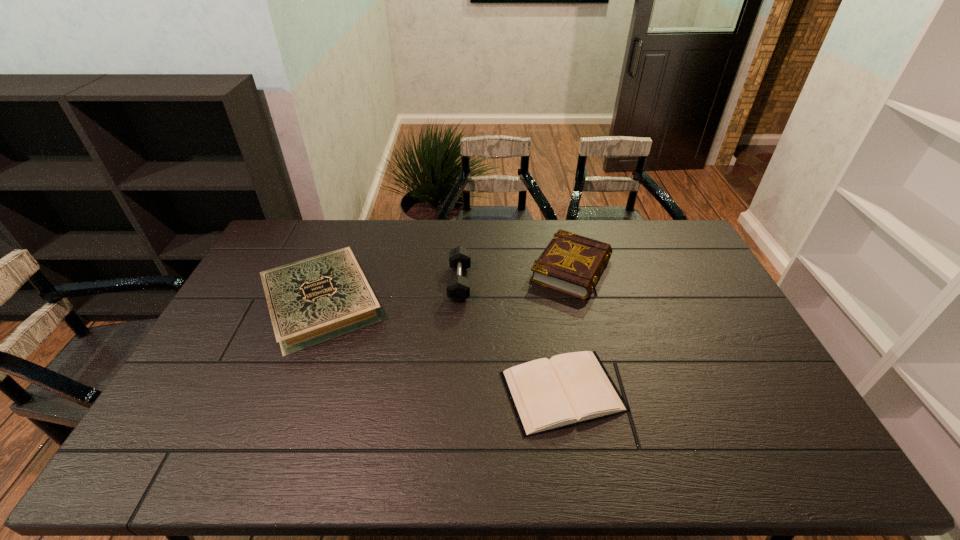
Identify the location of vacant space at the far edge. (612, 244).

Where is `vacant space at the left edge of the desktop`? This screenshot has height=540, width=960. vacant space at the left edge of the desktop is located at coordinates (251, 323).

Where is `free point at the right edge`? The height and width of the screenshot is (540, 960). free point at the right edge is located at coordinates (691, 312).

Locate an element on the screen. vacant space at the far right corner is located at coordinates (665, 237).

Where is `free space at the near right corner of the desktop`? This screenshot has height=540, width=960. free space at the near right corner of the desktop is located at coordinates (768, 440).

Find the location of a particular element. The width and height of the screenshot is (960, 540). empty space between the leftmost hardback book and the tallest object is located at coordinates (391, 293).

What are the coordinates of `vacant area that lies between the leftmost object and the shortest object` in the screenshot? It's located at (442, 347).

Locate an element on the screen. Image resolution: width=960 pixels, height=540 pixels. free spot between the dumbbell and the leftmost object is located at coordinates (391, 293).

Where is `empty space between the third object from right to left and the leftmost hardback book`? empty space between the third object from right to left and the leftmost hardback book is located at coordinates (391, 293).

At what (x,y) coordinates should I click in order to perform the action: click on the closest object to the leftmost object. Please return your answer as a coordinate pair (x, y). The height and width of the screenshot is (540, 960). Looking at the image, I should click on (458, 287).